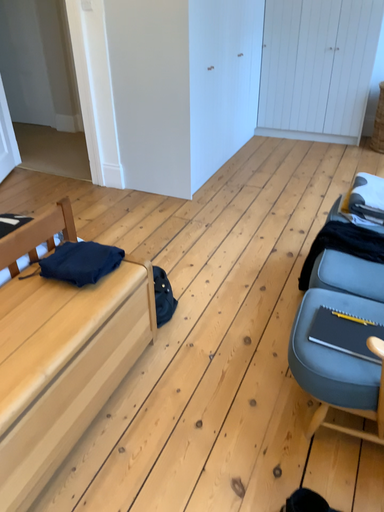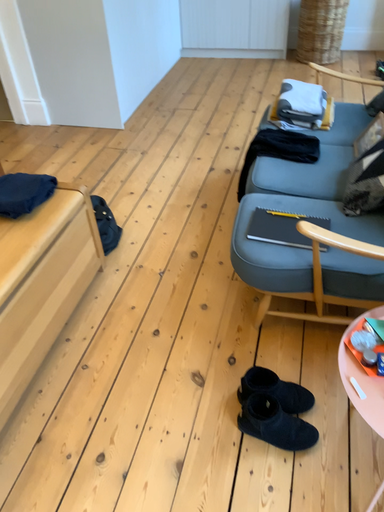
Question: How did the camera likely rotate when shooting the video?

Choices:
 (A) rotated downward
 (B) rotated upward

Answer: (A)